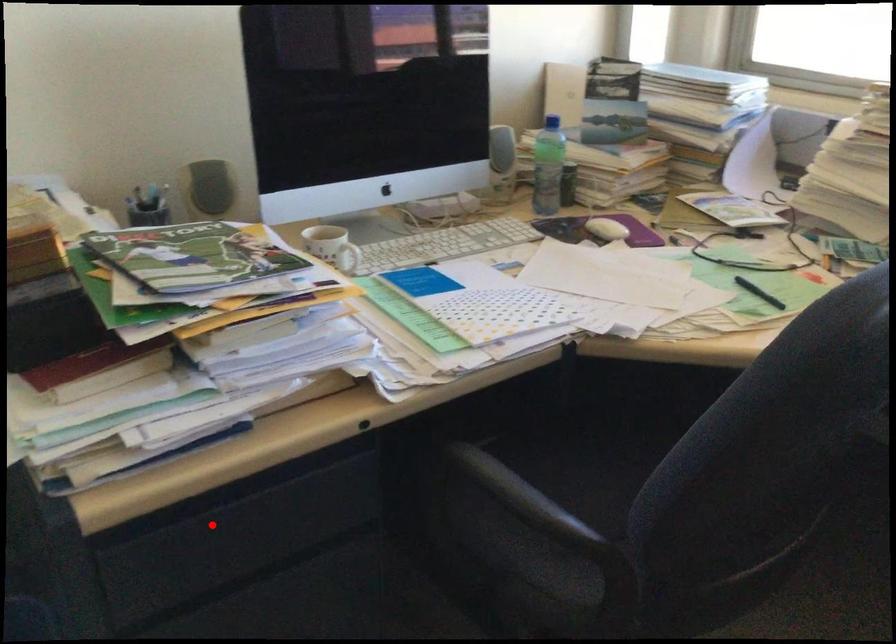
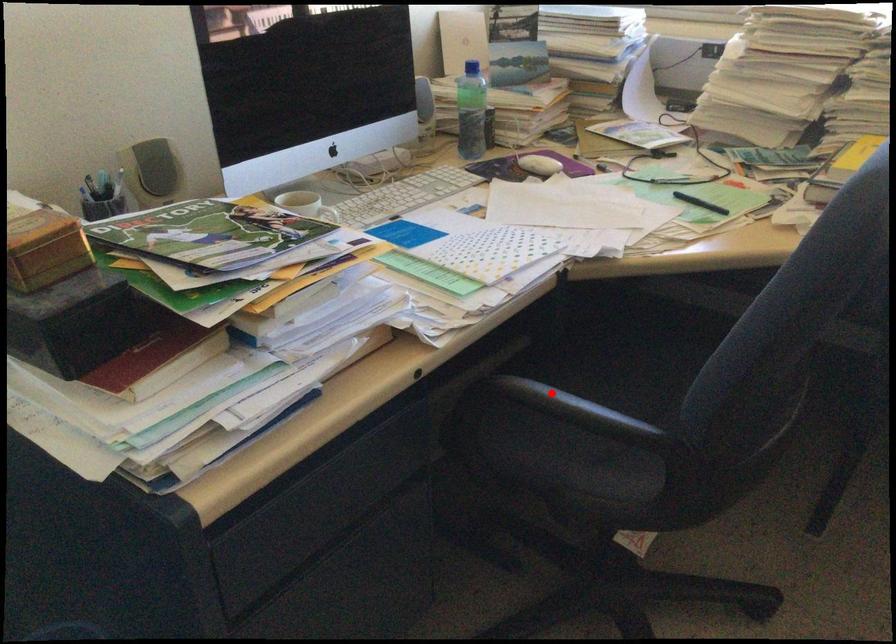
Looking at this image, I am providing you with two images of the same scene from different viewpoints. A red point is marked on the first image and another point is marked on the second image. Are the points marked in image1 and image2 representing the same 3D position?

No